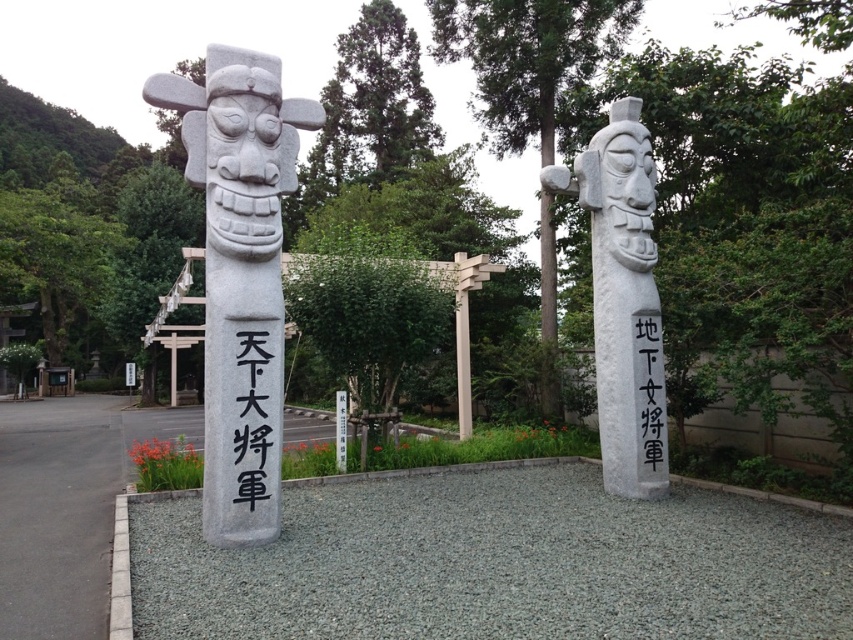
You are standing in front of the two stone statues at the shrine. There are two points marked on the statues. One is at coordinate point (260, 428) and the other at point (242, 416). Which of these points is closer to you?

Point (260, 428) is closer to you because it is further to the viewer than point (242, 416).

You are standing in front of the two stone statues at the shrine. The gray stone statue at left has the inscription

The gray stone statue at left is 5.29 meters from the camera, so it is closer to you than the other statue. Therefore, you can read the inscription on the gray stone statue at left more easily.

You are an archaeologist examining the stone structures in the scene. You need to determine which object is wider between the white stone pillar at left and the black stone text at center. Based on the spatial details, which one is wider?

The white stone pillar at left is wider than the black stone text at center according to the description.